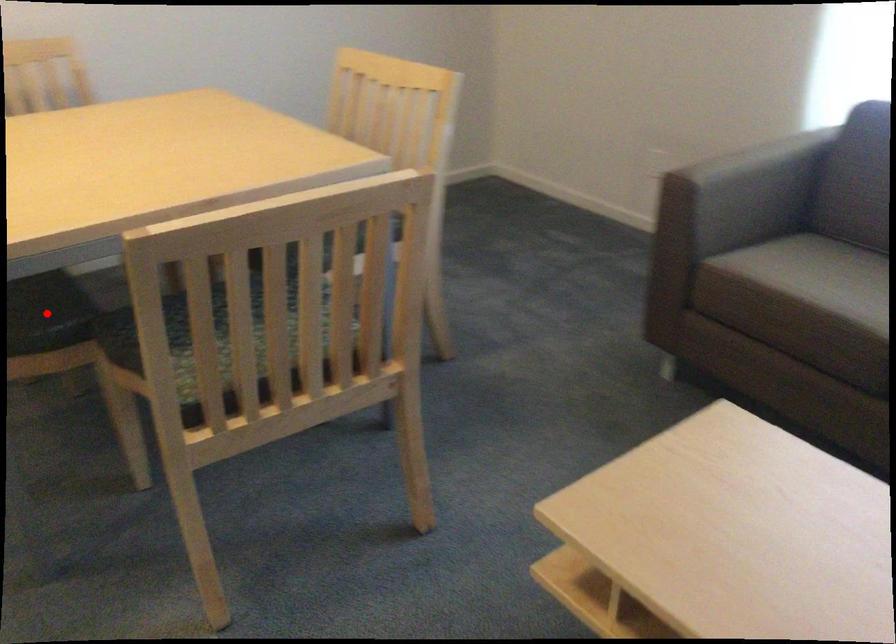
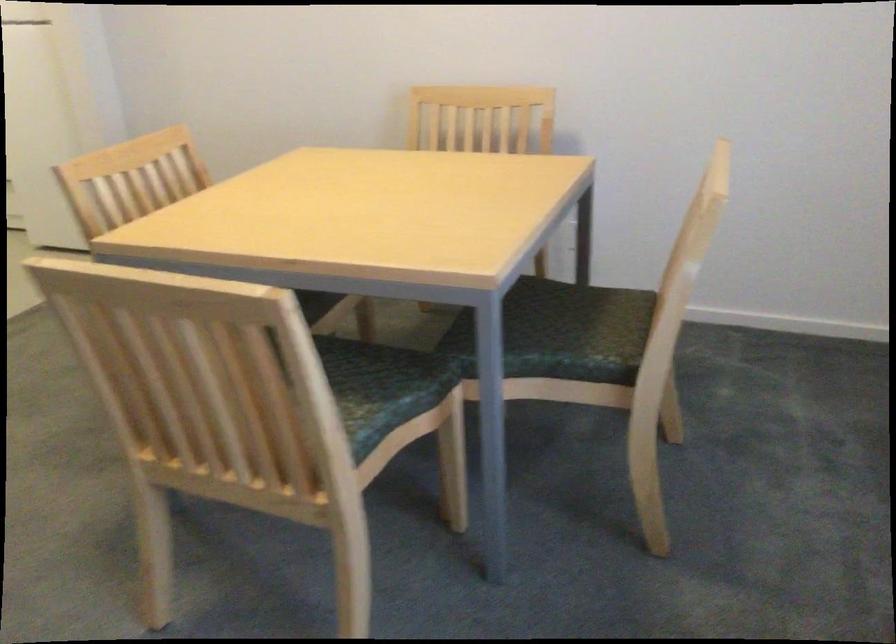
Question: I am providing you with two images of the same scene from different viewpoints. A red point is marked on the first image. At the location where the point appears in image 1, is it still visible in image 2?

Choices:
 (A) Yes
 (B) No

Answer: (B)